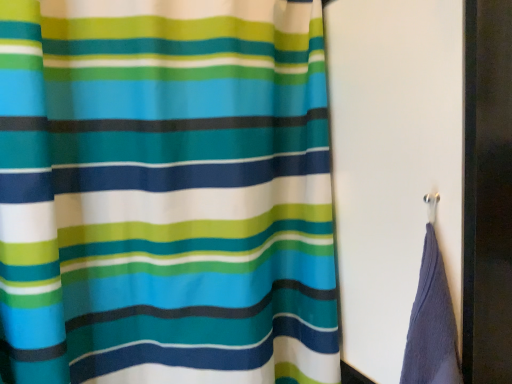
Question: Looking at their shapes, would you say metallic hook at right is wider or thinner than matte fabric curtain at upper right?

Choices:
 (A) wide
 (B) thin

Answer: (A)

Question: Is metallic hook at right situated inside matte fabric curtain at upper right or outside?

Choices:
 (A) inside
 (B) outside

Answer: (B)

Question: Does point (366, 339) appear closer or farther from the camera than point (231, 79)?

Choices:
 (A) farther
 (B) closer

Answer: (A)

Question: Is matte fabric curtain at upper right in front of or behind metallic hook at right in the image?

Choices:
 (A) front
 (B) behind

Answer: (A)

Question: Considering the relative positions of matte fabric curtain at upper right and metallic hook at right in the image provided, is matte fabric curtain at upper right to the left or to the right of metallic hook at right?

Choices:
 (A) right
 (B) left

Answer: (B)

Question: From a real-world perspective, is matte fabric curtain at upper right positioned above or below metallic hook at right?

Choices:
 (A) below
 (B) above

Answer: (A)

Question: From the image's perspective, is matte fabric curtain at upper right above or below metallic hook at right?

Choices:
 (A) below
 (B) above

Answer: (A)